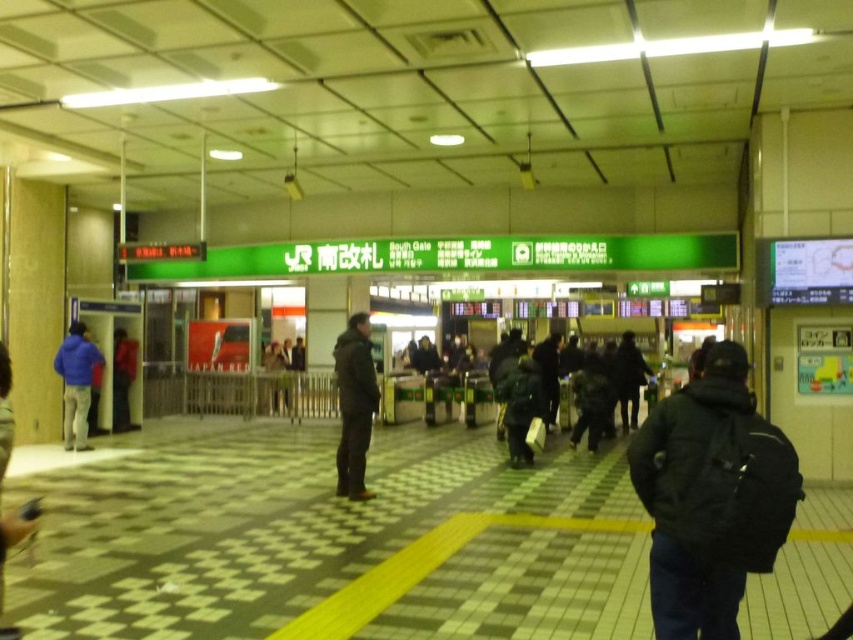
You are a traveler carrying a backpack and need to place both the black matte jacket at right and the blue fleece jacket at left on the checkered floor tiles. The backpack has a height of 60 cm. Which jacket can you stack on top of the backpack without exceeding its height?

The black matte jacket at right is not as tall as the blue fleece jacket at left. Since the backpack is 60 cm tall, the black matte jacket at right, being shorter, can be safely stacked on top without exceeding the backpack height. The blue fleece jacket at left is taller and might exceed the height limit.

You are a passenger carrying a suitcase and need to retrieve your matte black backpack at left from under the black matte jacket at right. Can you lift the jacket to access your backpack?

The black matte jacket at right is located above the matte black backpack at left, so you can lift the jacket to access the backpack.

You are a passenger carrying a large suitcase and need to pass between the black matte jacket at right and the blue fleece jacket at left. The suitcase is 1.2 meters long. Is there enough space between them to maneuver the suitcase through?

The black matte jacket at right is 10.34 meters away from the blue fleece jacket at left. Since the distance between them is significantly larger than the suitcase length of 1.2 meters, there is ample space to maneuver the suitcase through.